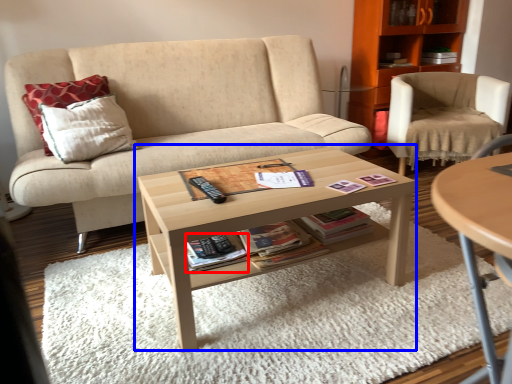
Question: Which object appears closest to the camera in this image, paperback book (highlighted by a red box) or coffee table (highlighted by a blue box)?

Choices:
 (A) paperback book
 (B) coffee table

Answer: (B)